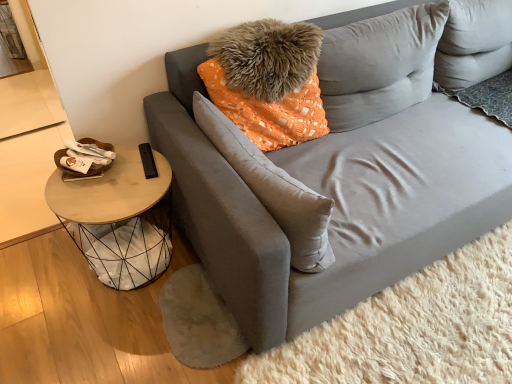
Identify the location of woodenmaterial/texture side table at left. (119, 219).

The height and width of the screenshot is (384, 512). Identify the location of velvet gray couch at center. (344, 168).

This screenshot has width=512, height=384. Describe the element at coordinates (379, 65) in the screenshot. I see `velvety gray pillow at upper right, arranged as the 1th pillow when viewed from the right` at that location.

This screenshot has width=512, height=384. I want to click on woodenmaterial/texture side table at left, so click(119, 219).

From the image's perspective, is velvety gray pillow at upper right, placed as the 2th pillow when sorted from left to right, located beneath velvet gray couch at center?

Incorrect, from the image's perspective, velvety gray pillow at upper right, placed as the 2th pillow when sorted from left to right, is higher than velvet gray couch at center.

Which object is positioned more to the left, velvety gray pillow at upper right, placed as the 2th pillow when sorted from left to right, or velvet gray couch at center?

velvety gray pillow at upper right, placed as the 2th pillow when sorted from left to right.

Is velvety gray pillow at upper right, placed as the 2th pillow when sorted from left to right, surrounding velvet gray couch at center?

No, velvet gray couch at center is not a part of velvety gray pillow at upper right, placed as the 2th pillow when sorted from left to right.

From the image's perspective, who appears lower, woodenmaterial/texture side table at left or suede gray pillow at center, which appears as the second pillow when viewed from the right?

woodenmaterial/texture side table at left.

Which is more distant, [78,215] or [279,172]?

The point [78,215] is farther.

Which is behind, woodenmaterial/texture side table at left or suede gray pillow at center, marked as the 1th pillow in a left-to-right arrangement?

woodenmaterial/texture side table at left is further from the camera.

Is woodenmaterial/texture side table at left next to suede gray pillow at center, which appears as the second pillow when viewed from the right, and touching it?

woodenmaterial/texture side table at left is not next to suede gray pillow at center, which appears as the second pillow when viewed from the right, and they're not touching.

Are suede gray pillow at center, which appears as the second pillow when viewed from the right, and woodenmaterial/texture side table at left making contact?

No, suede gray pillow at center, which appears as the second pillow when viewed from the right, is not making contact with woodenmaterial/texture side table at left.

Which is in front, point (315, 234) or point (90, 199)?

The point (315, 234) is closer.

Does suede gray pillow at center, which appears as the second pillow when viewed from the right, have a greater width compared to woodenmaterial/texture side table at left?

Incorrect, the width of suede gray pillow at center, which appears as the second pillow when viewed from the right, does not surpass that of woodenmaterial/texture side table at left.

Based on the photo, which is closer, (132, 179) or (242, 208)?

Clearly, point (132, 179) is more distant from the camera than point (242, 208).

Can you see woodenmaterial/texture side table at left touching velvet gray couch at center?

No, woodenmaterial/texture side table at left is not beside velvet gray couch at center.

Considering the relative sizes of woodenmaterial/texture side table at left and velvet gray couch at center in the image provided, is woodenmaterial/texture side table at left taller than velvet gray couch at center?

Incorrect, the height of woodenmaterial/texture side table at left is not larger of that of velvet gray couch at center.

Is velvet gray couch at center inside woodenmaterial/texture side table at left?

Definitely not — velvet gray couch at center is not inside woodenmaterial/texture side table at left.

Does woodenmaterial/texture side table at left have a greater width compared to velvety gray pillow at upper right, arranged as the 1th pillow when viewed from the right?

Yes.

Is woodenmaterial/texture side table at left turned away from velvety gray pillow at upper right, arranged as the 1th pillow when viewed from the right?

No, woodenmaterial/texture side table at left's orientation is not away from velvety gray pillow at upper right, arranged as the 1th pillow when viewed from the right.

Considering the sizes of objects woodenmaterial/texture side table at left and velvety gray pillow at upper right, placed as the 2th pillow when sorted from left to right, in the image provided, who is bigger, woodenmaterial/texture side table at left or velvety gray pillow at upper right, placed as the 2th pillow when sorted from left to right,?

woodenmaterial/texture side table at left is bigger.

Which object is closer to the camera, woodenmaterial/texture side table at left or velvety gray pillow at upper right, arranged as the 1th pillow when viewed from the right?

woodenmaterial/texture side table at left is in front.

Which of these two, velvet gray couch at center or suede gray pillow at center, which appears as the second pillow when viewed from the right, stands shorter?

Standing shorter between the two is suede gray pillow at center, which appears as the second pillow when viewed from the right.

Considering the sizes of objects velvet gray couch at center and suede gray pillow at center, which appears as the second pillow when viewed from the right, in the image provided, who is bigger, velvet gray couch at center or suede gray pillow at center, which appears as the second pillow when viewed from the right,?

Bigger between the two is velvet gray couch at center.

From a real-world perspective, which object rests below the other?

From a 3D spatial view, velvet gray couch at center is below.

Based on their positions, is velvet gray couch at center located to the left or right of suede gray pillow at center, marked as the 1th pillow in a left-to-right arrangement?

From the image, it's evident that velvet gray couch at center is to the right of suede gray pillow at center, marked as the 1th pillow in a left-to-right arrangement.

Which is nearer, (332, 231) or (365, 67)?

The point (332, 231) is more forward.

Would you say velvet gray couch at center is a long distance from velvety gray pillow at upper right, placed as the 2th pillow when sorted from left to right?

velvet gray couch at center is near velvety gray pillow at upper right, placed as the 2th pillow when sorted from left to right, not far away.

Considering the relative positions of velvet gray couch at center and velvety gray pillow at upper right, arranged as the 1th pillow when viewed from the right, in the image provided, is velvet gray couch at center in front of velvety gray pillow at upper right, arranged as the 1th pillow when viewed from the right,?

Yes.

Can you confirm if velvet gray couch at center is wider than velvety gray pillow at upper right, placed as the 2th pillow when sorted from left to right?

Indeed, velvet gray couch at center has a greater width compared to velvety gray pillow at upper right, placed as the 2th pillow when sorted from left to right.

The image size is (512, 384). I want to click on studio couch beneath the velvety gray pillow at upper right, arranged as the 1th pillow when viewed from the right (from a real-world perspective), so click(x=344, y=168).

I want to click on the 1st pillow counting from the right of the woodenmaterial/texture side table at left, so [273, 189].

Which object lies further to the anchor point woodenmaterial/texture side table at left, suede gray pillow at center, marked as the 1th pillow in a left-to-right arrangement, or velvet gray couch at center?

The object further to woodenmaterial/texture side table at left is velvet gray couch at center.

Based on the photo, estimate the real-world distances between objects in this image. Which object is further from suede gray pillow at center, marked as the 1th pillow in a left-to-right arrangement, velvety gray pillow at upper right, placed as the 2th pillow when sorted from left to right, or woodenmaterial/texture side table at left?

velvety gray pillow at upper right, placed as the 2th pillow when sorted from left to right.

Estimate the real-world distances between objects in this image. Which object is closer to velvety gray pillow at upper right, placed as the 2th pillow when sorted from left to right, velvet gray couch at center or woodenmaterial/texture side table at left?

The object closer to velvety gray pillow at upper right, placed as the 2th pillow when sorted from left to right, is velvet gray couch at center.

Which object lies nearer to the anchor point velvety gray pillow at upper right, arranged as the 1th pillow when viewed from the right, suede gray pillow at center, marked as the 1th pillow in a left-to-right arrangement, or velvet gray couch at center?

velvet gray couch at center is closer to velvety gray pillow at upper right, arranged as the 1th pillow when viewed from the right.

When comparing their distances from suede gray pillow at center, marked as the 1th pillow in a left-to-right arrangement, does woodenmaterial/texture side table at left or velvet gray couch at center seem further?

Among the two, woodenmaterial/texture side table at left is located further to suede gray pillow at center, marked as the 1th pillow in a left-to-right arrangement.

Considering their positions, is velvety gray pillow at upper right, placed as the 2th pillow when sorted from left to right, positioned further to woodenmaterial/texture side table at left than velvet gray couch at center?

velvety gray pillow at upper right, placed as the 2th pillow when sorted from left to right, is positioned further to the anchor woodenmaterial/texture side table at left.

When comparing their distances from velvety gray pillow at upper right, placed as the 2th pillow when sorted from left to right, does woodenmaterial/texture side table at left or suede gray pillow at center, which appears as the second pillow when viewed from the right, seem closer?

suede gray pillow at center, which appears as the second pillow when viewed from the right, lies closer to velvety gray pillow at upper right, placed as the 2th pillow when sorted from left to right, than the other object.

From the image, which object appears to be farther from velvet gray couch at center, woodenmaterial/texture side table at left or velvety gray pillow at upper right, arranged as the 1th pillow when viewed from the right?

woodenmaterial/texture side table at left is positioned further to the anchor velvet gray couch at center.

Where is `pillow located between woodenmaterial/texture side table at left and velvety gray pillow at upper right, arranged as the 1th pillow when viewed from the right, in the left-right direction`? The width and height of the screenshot is (512, 384). pillow located between woodenmaterial/texture side table at left and velvety gray pillow at upper right, arranged as the 1th pillow when viewed from the right, in the left-right direction is located at coordinates (273, 189).

Locate an element on the screen. Image resolution: width=512 pixels, height=384 pixels. pillow between suede gray pillow at center, which appears as the second pillow when viewed from the right, and velvet gray couch at center is located at coordinates (379, 65).